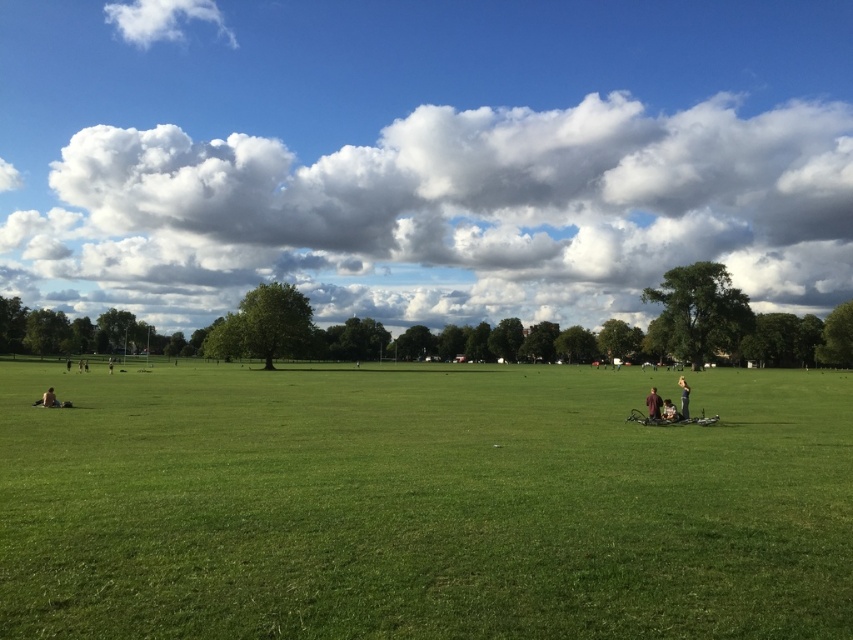
Who is more forward, (705,150) or (665,416)?

Point (665,416)

Does cloudy sky at upper center come behind white fabric jacket at lower center?

Yes.

I want to click on cloudy sky at upper center, so click(x=422, y=154).

Which is more to the left, dark gray fabric person at lower right or white fabric jacket at lower center?

white fabric jacket at lower center is more to the left.

This screenshot has height=640, width=853. Describe the element at coordinates (653, 404) in the screenshot. I see `dark gray fabric person at lower right` at that location.

Locate an element on the screen. The height and width of the screenshot is (640, 853). dark gray fabric person at lower right is located at coordinates 653,404.

Who is taller, green grass at center or brown leather jacket at lower right?

brown leather jacket at lower right is taller.

Who is shorter, green grass at center or brown leather jacket at lower right?

green grass at center

Does point (88, 529) come farther from viewer compared to point (680, 412)?

No, (88, 529) is closer to viewer.

Locate an element on the screen. This screenshot has height=640, width=853. green grass at center is located at coordinates (422, 502).